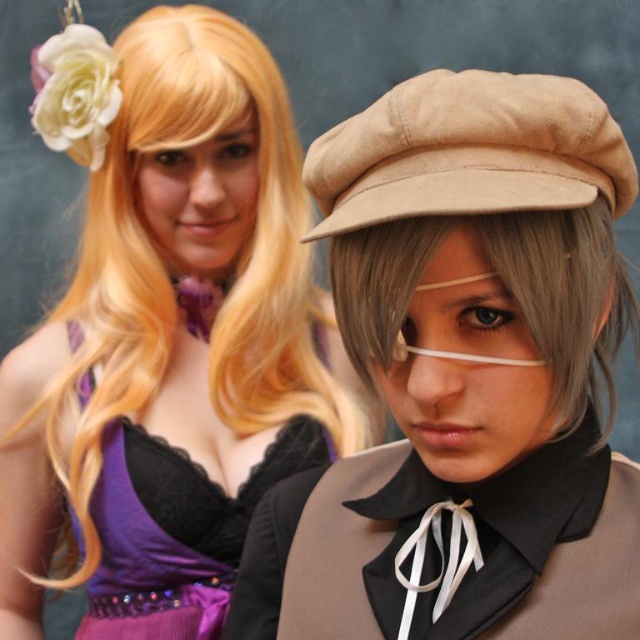
Question: Estimate the real-world distances between objects in this image. Which object is closer to the matte blonde wig at upper left?

Choices:
 (A) gray matte wig at center
 (B) suede beige beret at center

Answer: (A)

Question: Which object is the closest to the matte blonde wig at upper left?

Choices:
 (A) suede beige beret at center
 (B) gray matte wig at center

Answer: (B)

Question: Can you confirm if matte blonde wig at upper left is bigger than gray matte wig at center?

Choices:
 (A) yes
 (B) no

Answer: (A)

Question: Does matte blonde wig at upper left have a greater width compared to gray matte wig at center?

Choices:
 (A) yes
 (B) no

Answer: (A)

Question: Estimate the real-world distances between objects in this image. Which object is closer to the suede beige beret at center?

Choices:
 (A) gray matte wig at center
 (B) matte blonde wig at upper left

Answer: (A)

Question: Is matte blonde wig at upper left closer to camera compared to gray matte wig at center?

Choices:
 (A) yes
 (B) no

Answer: (B)